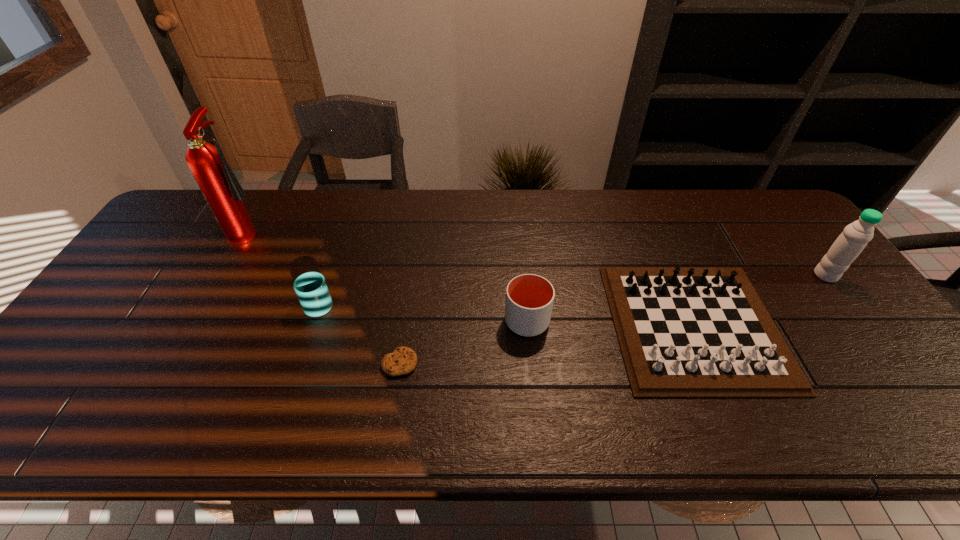
Where is `vacant space in between the second shortest object and the farthest object`? vacant space in between the second shortest object and the farthest object is located at coordinates pyautogui.click(x=472, y=278).

Where is `free point between the cookie and the fifth object from left to right`? The width and height of the screenshot is (960, 540). free point between the cookie and the fifth object from left to right is located at coordinates (547, 344).

This screenshot has height=540, width=960. I want to click on free space between the fire extinguisher and the right cup, so click(389, 276).

Choose which object is the third nearest neighbor to the water bottle. Please provide its 2D coordinates. Your answer should be formatted as a tuple, i.e. [(x, y)], where the tuple contains the x and y coordinates of a point satisfying the conditions above.

[(403, 360)]

Locate an element on the screen. The height and width of the screenshot is (540, 960). object that can be found as the fifth closest to the rightmost object is located at coordinates (220, 187).

The image size is (960, 540). What are the coordinates of `vacant space that satisfies the following two spatial constraints: 1. at the nozzle of the tallest object; 2. on the right side of the gameboard` in the screenshot? It's located at (198, 326).

Locate an element on the screen. free region that satisfies the following two spatial constraints: 1. on the handle side of the shorter cup; 2. at the nozzle of the fire extinguisher is located at coordinates (344, 231).

This screenshot has width=960, height=540. Identify the location of free space that satisfies the following two spatial constraints: 1. on the back side of the right cup; 2. at the nozzle of the leftmost object. (518, 231).

At what (x,y) coordinates should I click in order to perform the action: click on vacant space that satisfies the following two spatial constraints: 1. on the back side of the second shortest object; 2. at the nozzle of the tallest object. Please return your answer as a coordinate pair (x, y). The image size is (960, 540). Looking at the image, I should click on (654, 231).

Where is `free space that satisfies the following two spatial constraints: 1. at the nozzle of the farthest object; 2. on the left side of the third object from right to left`? This screenshot has height=540, width=960. free space that satisfies the following two spatial constraints: 1. at the nozzle of the farthest object; 2. on the left side of the third object from right to left is located at coordinates (201, 321).